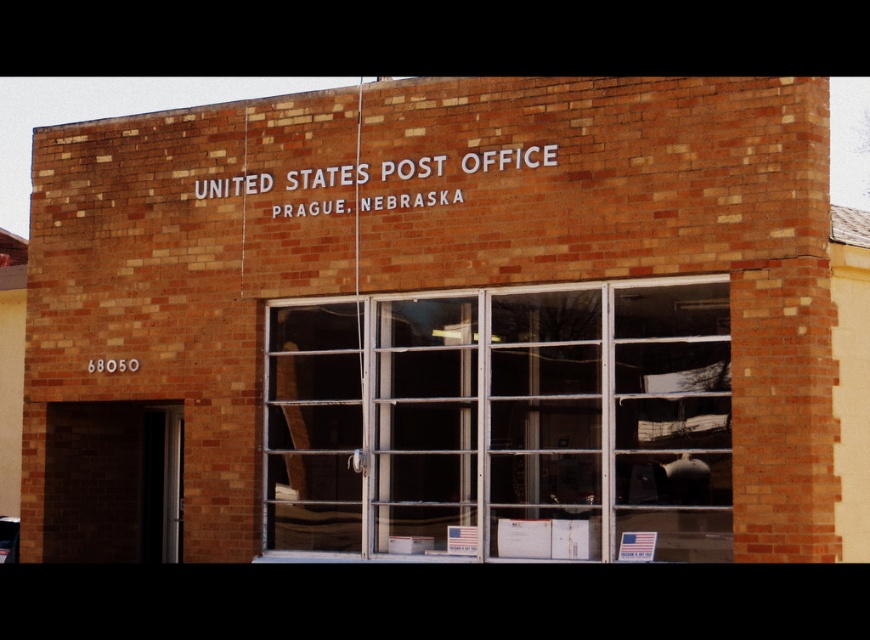
Question: Which of the following is the farthest from the observer?

Choices:
 (A) (435, 193)
 (B) (569, 262)
 (C) (641, 516)

Answer: (A)

Question: Which point is farther from the camera taking this photo?

Choices:
 (A) (524, 342)
 (B) (435, 202)

Answer: (B)

Question: Is clear glass window at center to the left of white painted brick sign at upper center from the viewer's perspective?

Choices:
 (A) yes
 (B) no

Answer: (B)

Question: Does brown brick building at center have a smaller size compared to white painted brick sign at upper center?

Choices:
 (A) yes
 (B) no

Answer: (A)

Question: Is brown brick building at center above clear glass window at center?

Choices:
 (A) no
 (B) yes

Answer: (B)

Question: Which object appears closest to the camera in this image?

Choices:
 (A) clear glass window at center
 (B) brown brick building at center

Answer: (B)